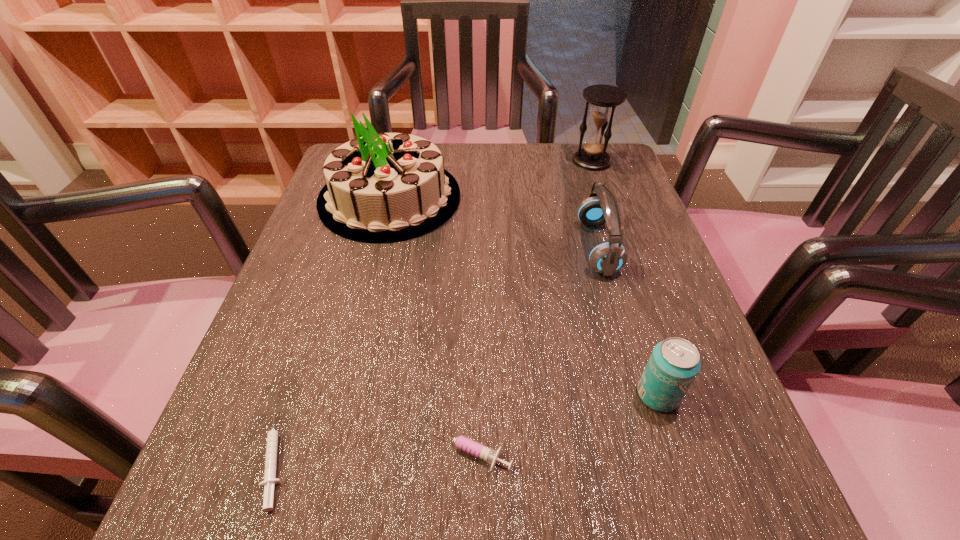
Image resolution: width=960 pixels, height=540 pixels. I want to click on birthday cake, so click(382, 187).

Identify the location of hourglass. (604, 98).

Where is `headset`? Image resolution: width=960 pixels, height=540 pixels. headset is located at coordinates (601, 207).

Locate an element on the screen. The image size is (960, 540). the third shortest object is located at coordinates (674, 363).

In order to click on the taller syringe in this screenshot , I will do `click(467, 445)`.

Where is `the fifth tallest object`? Image resolution: width=960 pixels, height=540 pixels. the fifth tallest object is located at coordinates (467, 445).

Identify the location of the left syringe. Image resolution: width=960 pixels, height=540 pixels. (270, 480).

Identify the location of the shorter syringe. The image size is (960, 540). (270, 480).

The height and width of the screenshot is (540, 960). Identify the location of free space located on the front of the tallest object. (363, 305).

Locate an element on the screen. Image resolution: width=960 pixels, height=540 pixels. vacant space located 0.350m on the front of the second tallest object is located at coordinates (629, 268).